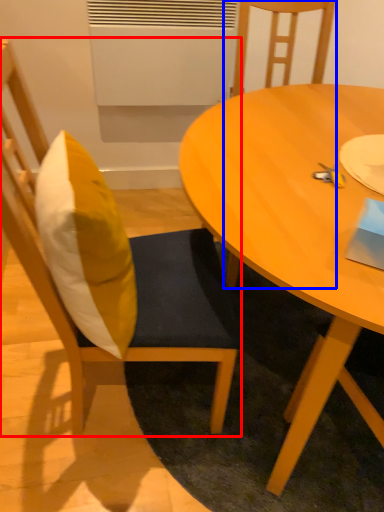
Question: Which of the following is the closest to the observer, chair (highlighted by a red box) or chair (highlighted by a blue box)?

Choices:
 (A) chair
 (B) chair

Answer: (A)